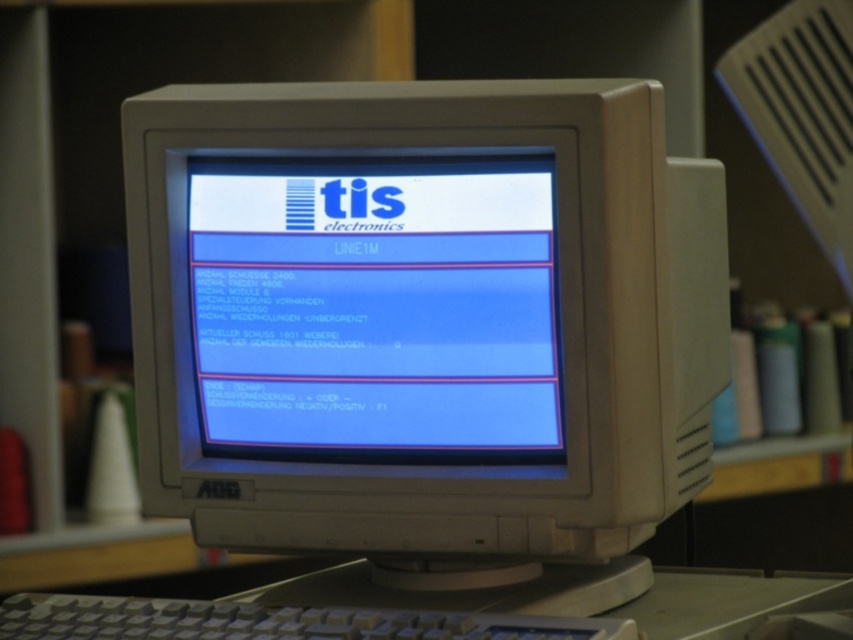
You are looking at the vintage CRT monitor. There are two points marked on the screen at coordinates point (206, 332) and point (53, 349). Which point is closer to your view?

Point (206, 332) is closer to the camera than point (53, 349).

You are a technician who needs to adjust the focus of the blue glossy monitor at center. The optimal viewing distance for this monitor is 30 inches. Based on the provided information, is the current distance within the recommended range?

The blue glossy monitor at center is 33.32 inches away from the camera, which is slightly beyond the optimal viewing distance of 30 inches. Therefore, it is recommended to move the monitor closer to achieve the best focus.

You are setting up a new workspace and need to place both the blue glossy monitor at center and the gray plastic keyboard at center on your desk. If the desk has limited space, which object should you prioritize placing first to ensure it fits properly?

The blue glossy monitor at center is bigger than the gray plastic keyboard at center, so you should prioritize placing the blue glossy monitor at center first to ensure it fits properly on the desk.